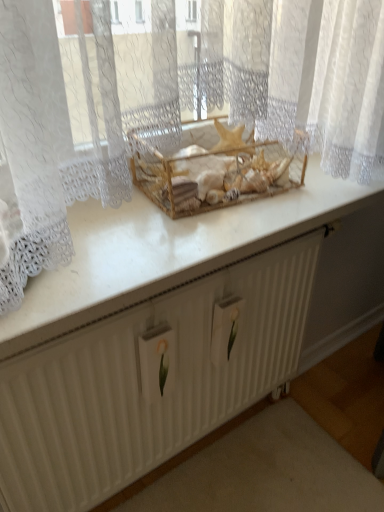
The height and width of the screenshot is (512, 384). Find the location of `free space in front of wooden crate at center`. free space in front of wooden crate at center is located at coordinates (195, 234).